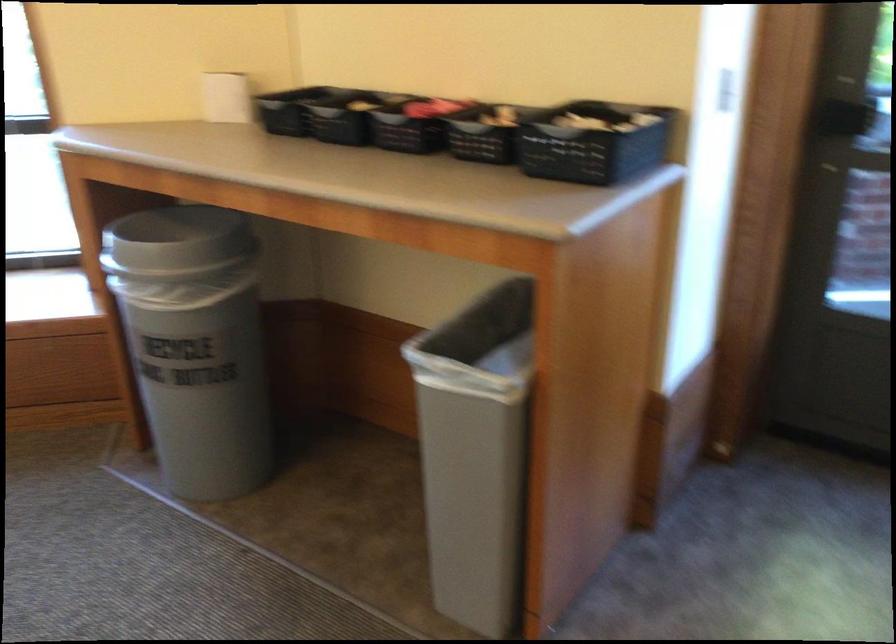
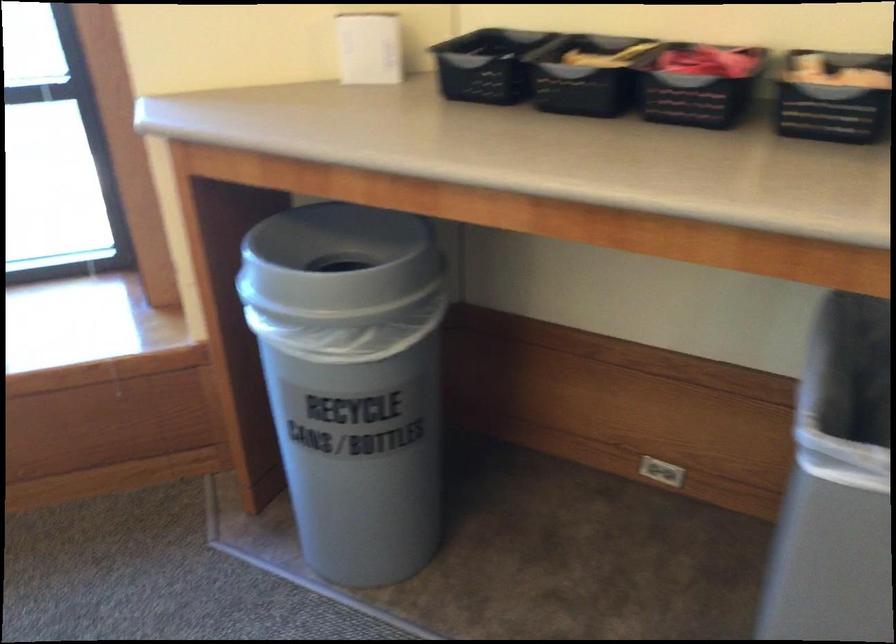
Question: Based on the continuous images, in which direction is the camera rotating? Reply with the corresponding letter.

Choices:
 (A) Left
 (B) Right
 (C) Up
 (D) Down

Answer: (B)